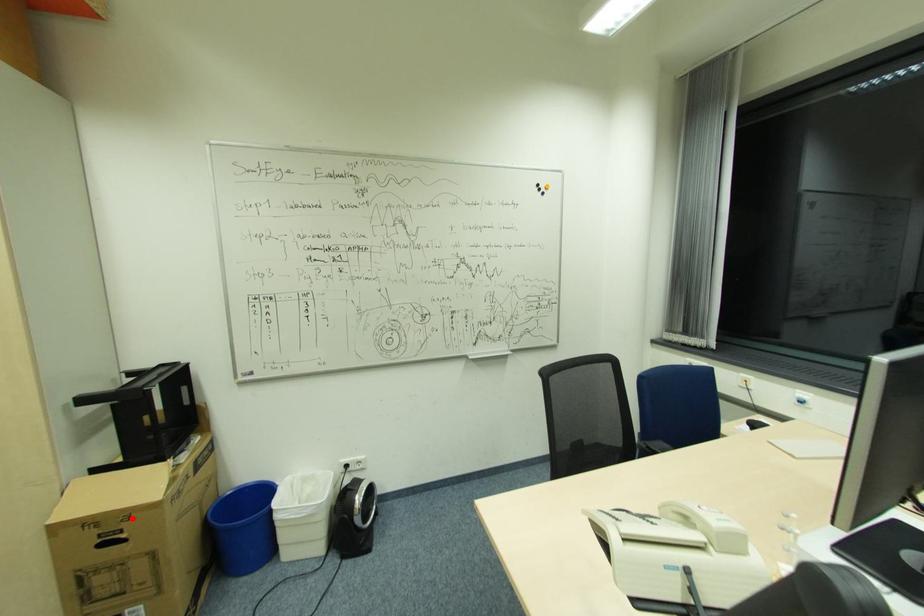
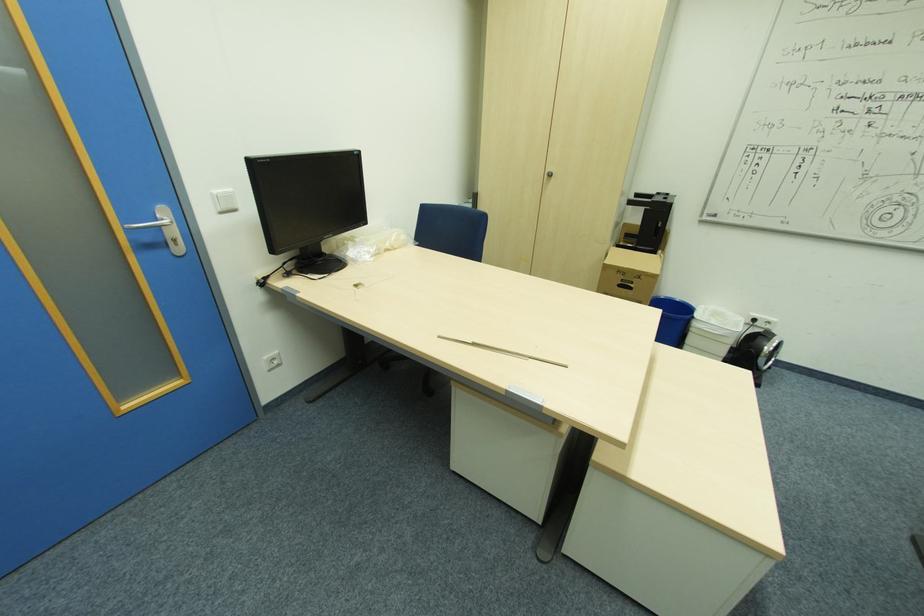
Question: I am providing you with two images of the same scene from different viewpoints. A red point is shown in image1. For the corresponding object point in image2, is it positioned nearer or farther from the camera?

Choices:
 (A) Nearer
 (B) Farther

Answer: (B)